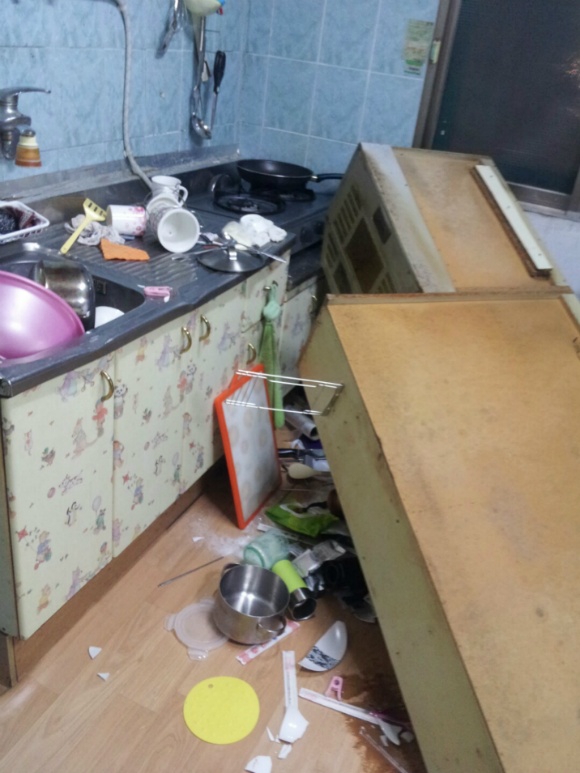
Where is `cupboard handle`? The height and width of the screenshot is (773, 580). cupboard handle is located at coordinates (108, 386), (186, 334), (209, 328), (253, 349).